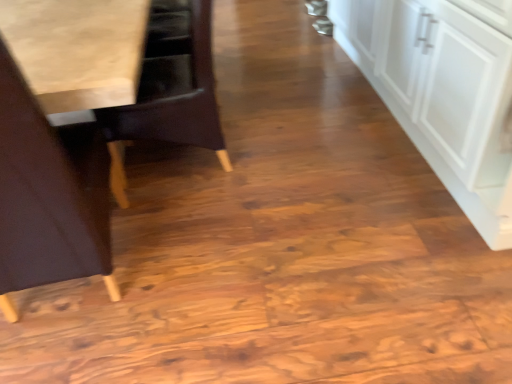
This screenshot has height=384, width=512. In order to click on vacant space underneath wooden chair at left, positioned as the first chair in back-to-front order (from a real-world perspective) in this screenshot , I will do `click(200, 161)`.